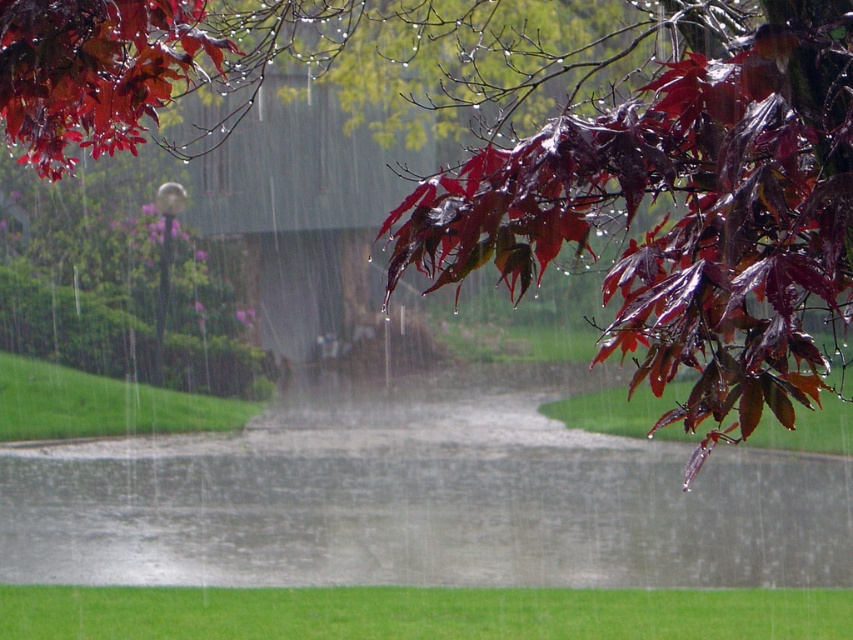
Is glossy dark red maple leaves at upper right wider than glossy red maple leaf at upper left?

Indeed, glossy dark red maple leaves at upper right has a greater width compared to glossy red maple leaf at upper left.

Is point (531, 275) more distant than point (84, 116)?

No.

Is point (683, 99) closer to viewer compared to point (4, 4)?

Yes, it is.

Where is `glossy dark red maple leaves at upper right`? The width and height of the screenshot is (853, 640). glossy dark red maple leaves at upper right is located at coordinates (683, 205).